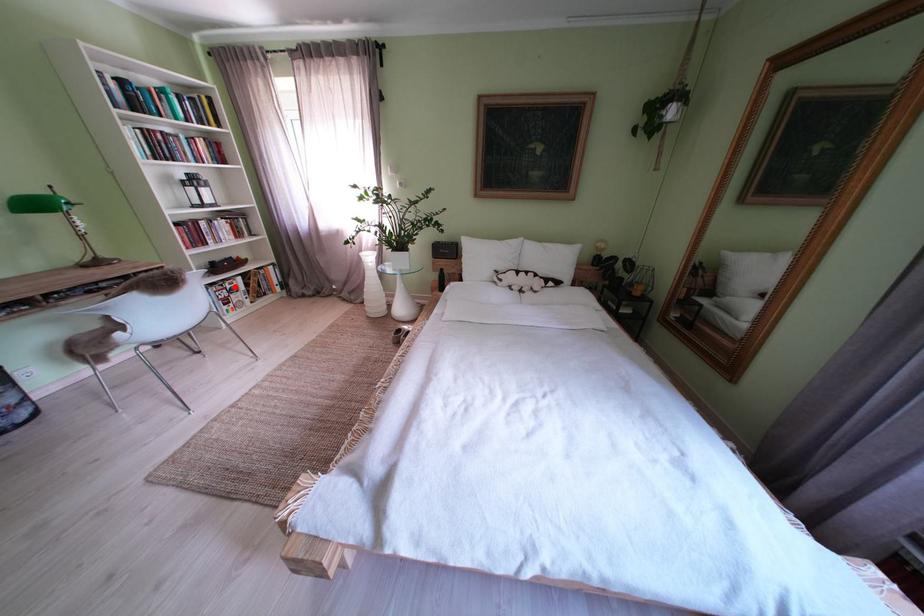
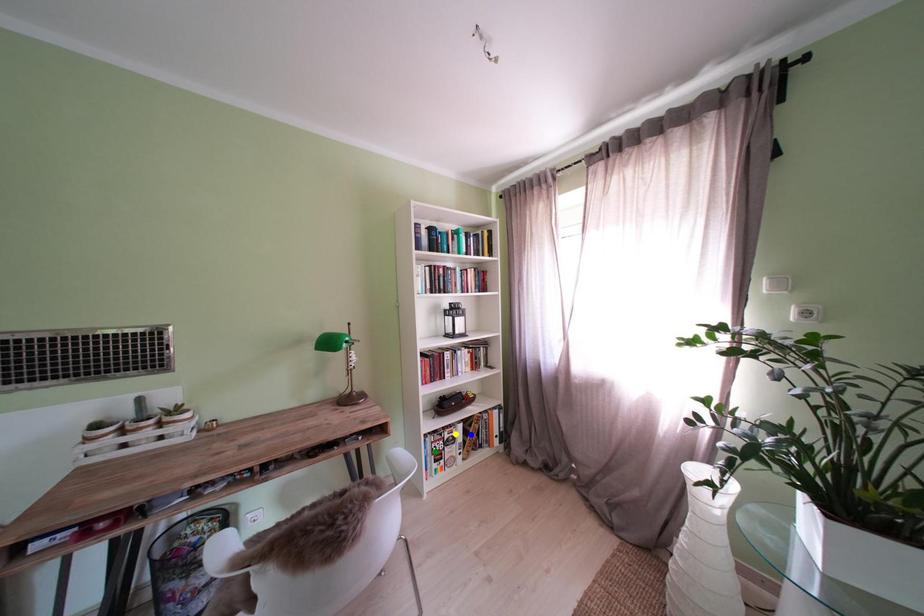
Question: I am providing you with two images of the same scene from different viewpoints. A red point is marked on the first image. You are given multiple points on the second image. Which spot in image 2 lines up with the point in image 1?

Choices:
 (A) green point
 (B) blue point
 (C) yellow point

Answer: (C)